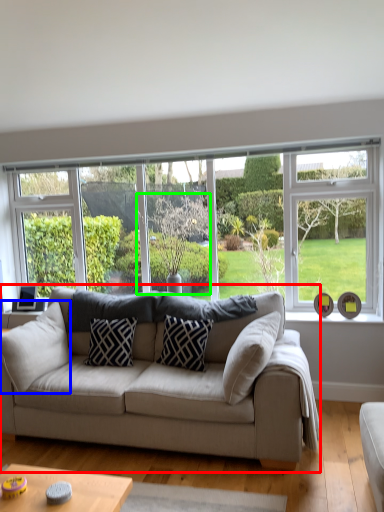
Question: Which object is the farthest from studio couch (highlighted by a red box)? Choose among these: pillow (highlighted by a blue box) or tree (highlighted by a green box).

Choices:
 (A) pillow
 (B) tree

Answer: (B)